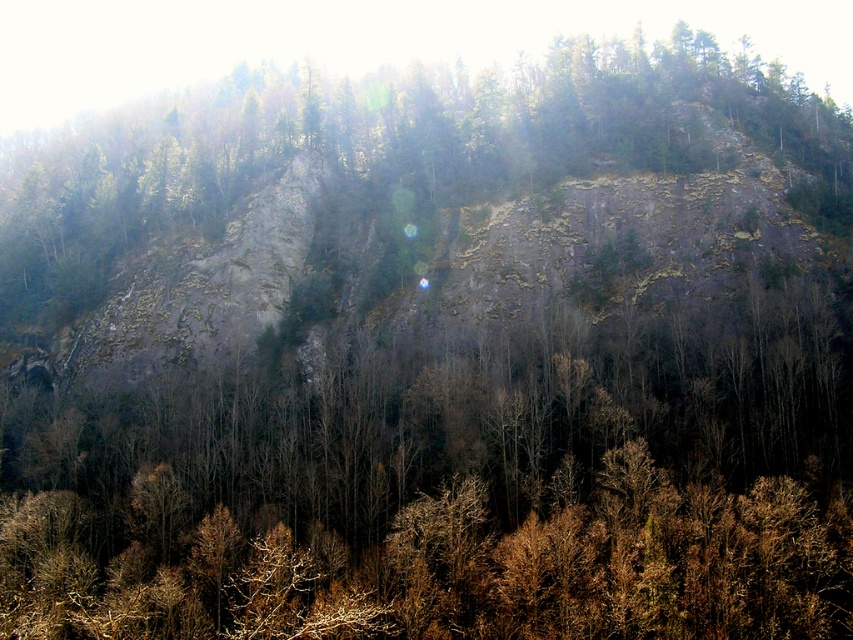
Is point (689, 394) positioned before point (534, 170)?

Yes.

Can you confirm if dark brown bark tree at center is positioned to the right of green rough rock at upper center?

Correct, you'll find dark brown bark tree at center to the right of green rough rock at upper center.

Is point (288, 481) behind point (399, 177)?

That is False.

This screenshot has width=853, height=640. I want to click on dark brown bark tree at center, so click(x=454, y=486).